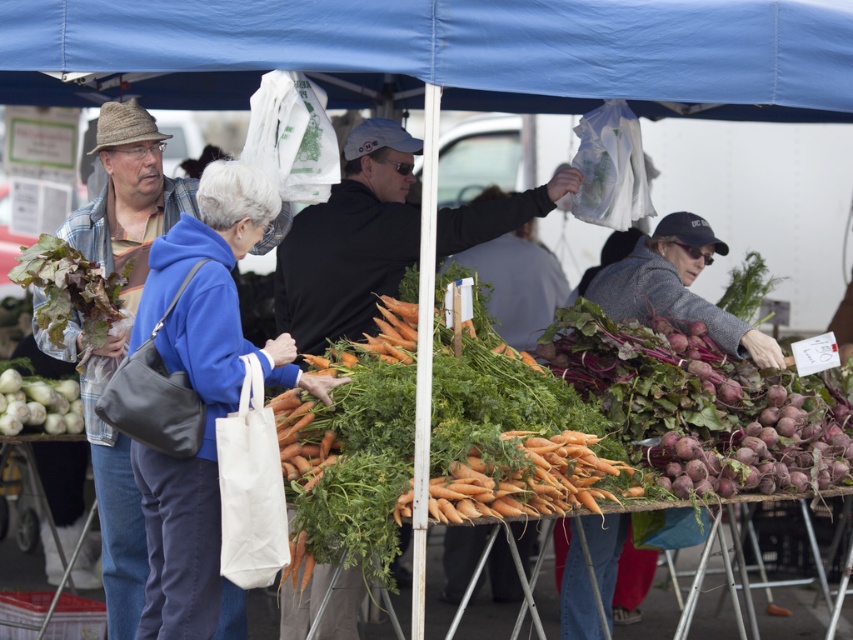
You are a customer at the farmer market and you want to see the produce on the table without obstruction. Which object between the blue fabric canopy at upper center and the black matte jacket at center is closer to your line of sight?

The black matte jacket at center is closer to your line of sight because the blue fabric canopy at upper center has a lesser height compared to it, meaning the jacket is in front.

You are standing at the farmer market and want to find the shortest path to the carrots. The carrots are located at point (523, 500) and the beets are at point (83, 266). Which direction should you move towards first?

You should move towards point (523, 500) first since it is in front of point (83, 266), meaning it is closer to your current position.